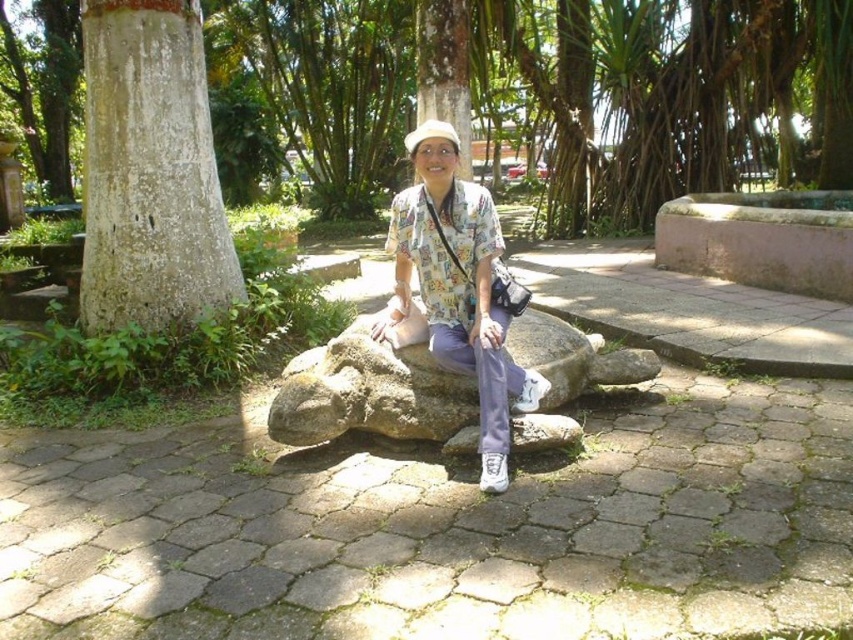
Question: Which point is farther to the camera?

Choices:
 (A) (447, 288)
 (B) (190, 189)
 (C) (421, 124)

Answer: (C)

Question: Is white rough bark tree at left closer to camera compared to printed cotton shirt at center?

Choices:
 (A) no
 (B) yes

Answer: (A)

Question: Does white rough bark tree at left have a larger size compared to printed cotton shirt at center?

Choices:
 (A) yes
 (B) no

Answer: (A)

Question: Which of the following is the farthest from the observer?

Choices:
 (A) (109, 22)
 (B) (451, 144)
 (C) (244, 3)
 (D) (505, 404)

Answer: (C)

Question: Which of these objects is positioned closest to the white fabric hat at center?

Choices:
 (A) rough bark tree at center
 (B) printed cotton shirt at center
 (C) white rough bark tree at left

Answer: (B)

Question: Can you confirm if white rough bark tree at left is bigger than printed cotton shirt at center?

Choices:
 (A) yes
 (B) no

Answer: (A)